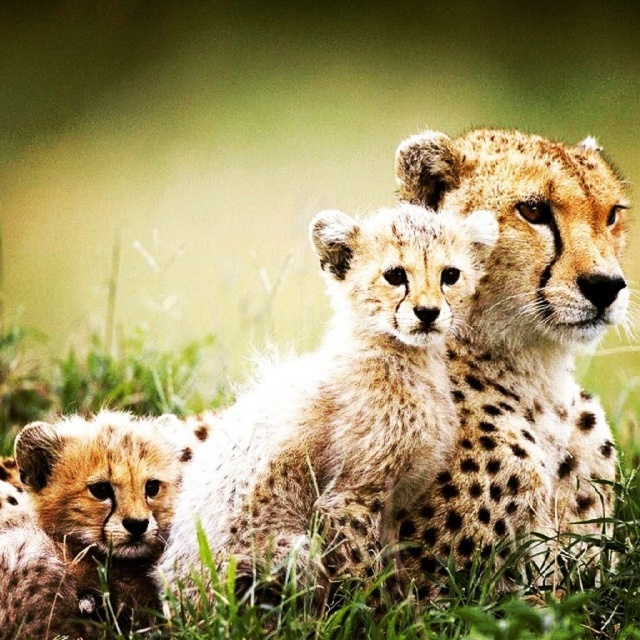
Question: Can you confirm if spotted fur cub at center is positioned above spotted fur cheetah at upper center?

Choices:
 (A) no
 (B) yes

Answer: (A)

Question: Which point appears closest to the camera in this image?

Choices:
 (A) (493, 205)
 (B) (202, 496)

Answer: (B)

Question: Can you confirm if spotted fur cub at center is bigger than spotted fur cheetah at upper center?

Choices:
 (A) yes
 (B) no

Answer: (A)

Question: Is spotted fur cub at center below spotted fur cheetah at upper center?

Choices:
 (A) no
 (B) yes

Answer: (B)

Question: Among these points, which one is nearest to the camera?

Choices:
 (A) (168, 536)
 (B) (486, 163)

Answer: (B)